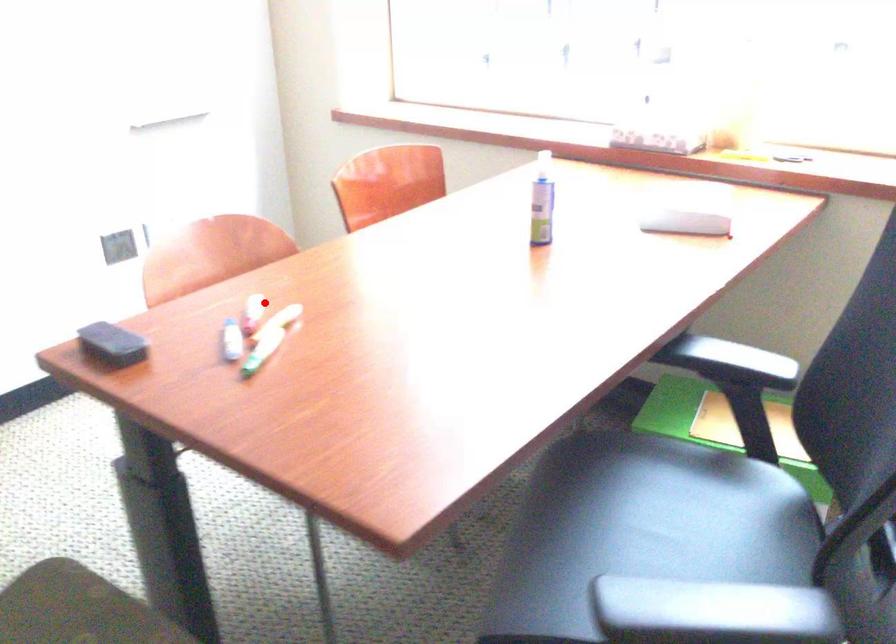
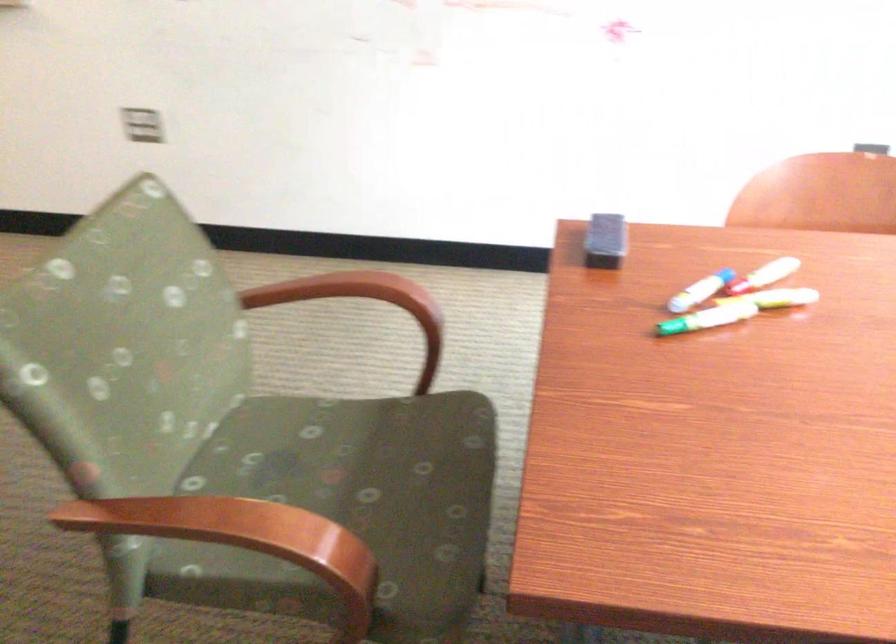
In the second image, find the point that corresponds to the highlighted location in the first image.

(773, 270)